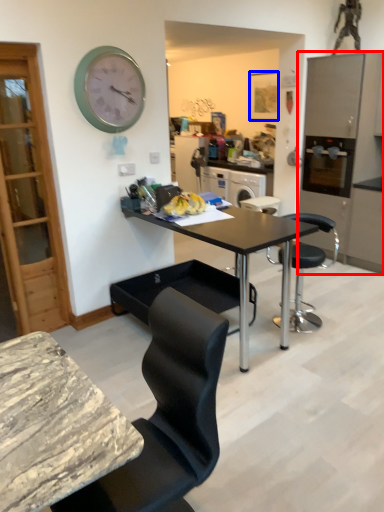
Question: Which of the following is the farthest to the observer, cabinetry (highlighted by a red box) or picture frame (highlighted by a blue box)?

Choices:
 (A) cabinetry
 (B) picture frame

Answer: (B)